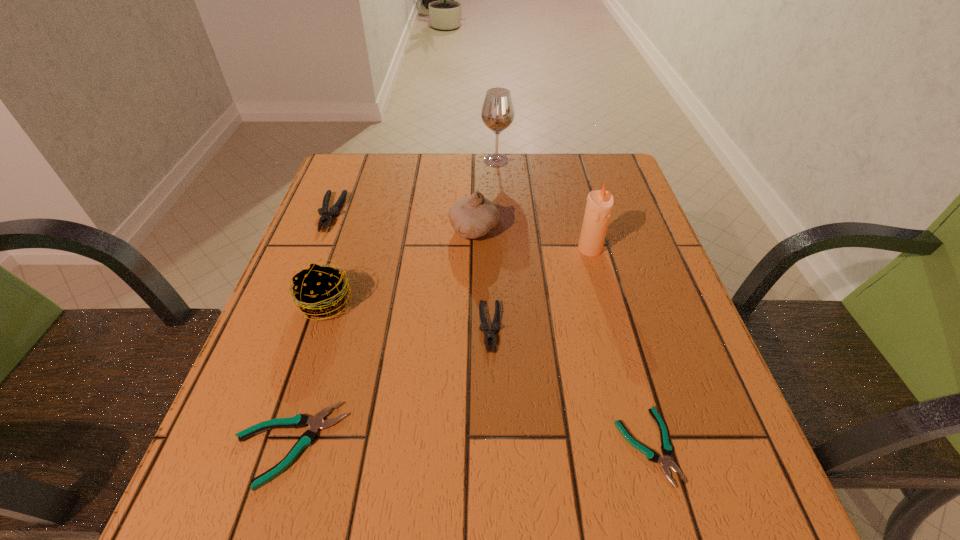
The image size is (960, 540). What are the coordinates of `the farthest object` in the screenshot? It's located at (497, 114).

The image size is (960, 540). In order to click on candle in this screenshot , I will do `click(599, 206)`.

The height and width of the screenshot is (540, 960). Identify the location of garlic. (473, 216).

Find the location of a particular element. patty is located at coordinates (320, 291).

At what (x,y) coordinates should I click in order to perform the action: click on the bigger gray pliers. Please return your answer as a coordinate pair (x, y). The height and width of the screenshot is (540, 960). Looking at the image, I should click on (327, 216).

The image size is (960, 540). I want to click on the farthest pliers, so click(327, 216).

Identify the location of the nearer gray pliers. The height and width of the screenshot is (540, 960). (489, 334).

Locate an element on the screen. The image size is (960, 540). the smaller gray pliers is located at coordinates (489, 334).

Where is `the second shortest object`? The width and height of the screenshot is (960, 540). the second shortest object is located at coordinates (315, 423).

The height and width of the screenshot is (540, 960). What are the coordinates of `the left teal pliers` in the screenshot? It's located at coord(315,423).